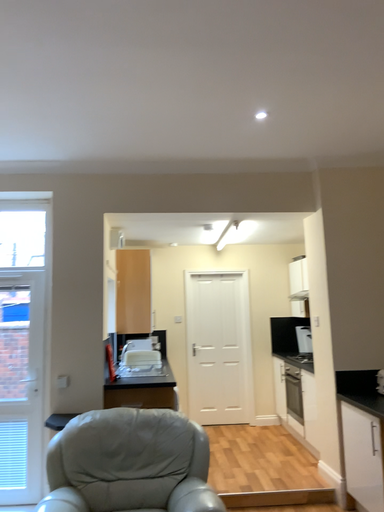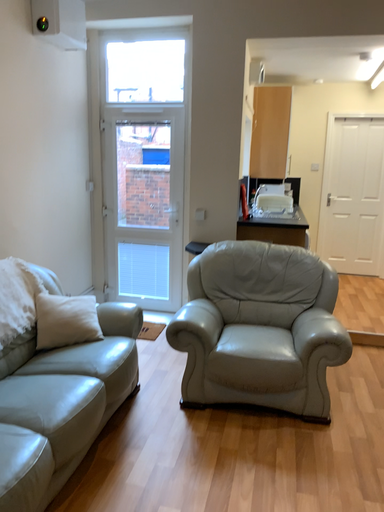
Question: How did the camera likely rotate when shooting the video?

Choices:
 (A) rotated right
 (B) rotated left

Answer: (B)